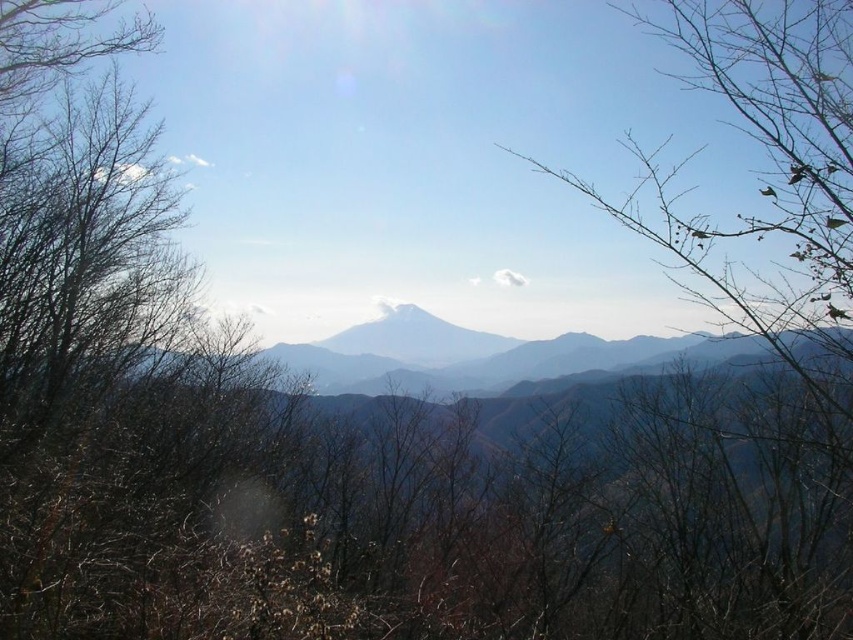
Who is positioned more to the right, brown/dry branches at left or white snow-capped peak at center?

From the viewer's perspective, white snow-capped peak at center appears more on the right side.

Which is below, brown/dry branches at left or white snow-capped peak at center?

white snow-capped peak at center is below.

This screenshot has height=640, width=853. In order to click on brown/dry branches at left in this screenshot , I will do `click(119, 378)`.

Can you confirm if brown leafless branches at upper right is positioned below gray foggy mountain range at center?

Incorrect, brown leafless branches at upper right is not positioned below gray foggy mountain range at center.

Who is more distant from viewer, (831, 189) or (463, 349)?

Point (463, 349)

At what (x,y) coordinates should I click in order to perform the action: click on brown leafless branches at upper right. Please return your answer as a coordinate pair (x, y). Looking at the image, I should click on (770, 192).

Which is below, brown/dry branches at left or brown leafless branches at upper right?

brown/dry branches at left is below.

Which of these two, brown/dry branches at left or brown leafless branches at upper right, stands taller?

Standing taller between the two is brown leafless branches at upper right.

Is point (26, 404) less distant than point (833, 387)?

No, it is behind (833, 387).

I want to click on brown/dry branches at left, so point(119,378).